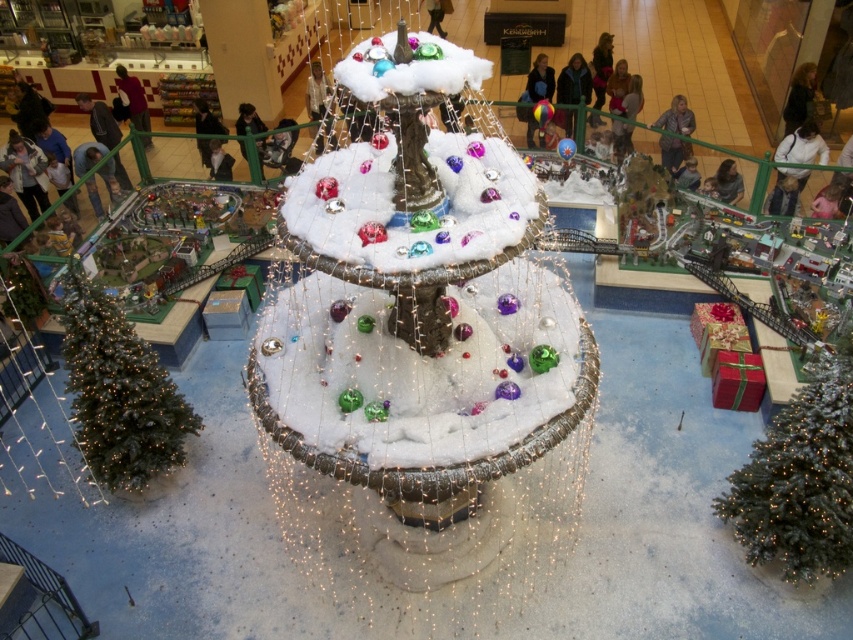
From the picture: You are a photographer setting up a shot of the festive indoor setting. You need to position your camera so that both the green matte christmas tree at lower right and the green matte christmas tree at lower left are in frame. Which tree should you focus on first if you want to ensure the taller tree is in focus?

The green matte christmas tree at lower right is taller than the green matte christmas tree at lower left, so you should focus on the green matte christmas tree at lower right first to ensure the taller tree is in focus.

You are a maintenance worker tasked with checking the distance between the two green matte christmas trees. Given that your measuring tape can only extend up to 6 meters, will you be able to measure the distance between the green matte christmas tree at lower right and the green matte christmas tree at lower left?

The green matte christmas tree at lower right and green matte christmas tree at lower left are 6.24 meters apart from each other. Since your measuring tape can only extend up to 6 meters, you will not be able to measure the entire distance between them.

You are a photographer positioned in front of the fountain and want to capture both green matte christmas tree at lower right and green matte christmas tree at lower left in a single frame. Which direction should you move to ensure both trees are visible in your camera view?

You should move to the left of the fountain to ensure both green matte christmas tree at lower right and green matte christmas tree at lower left are visible in your camera view, as the green matte christmas tree at lower right is positioned to the right of the other tree.